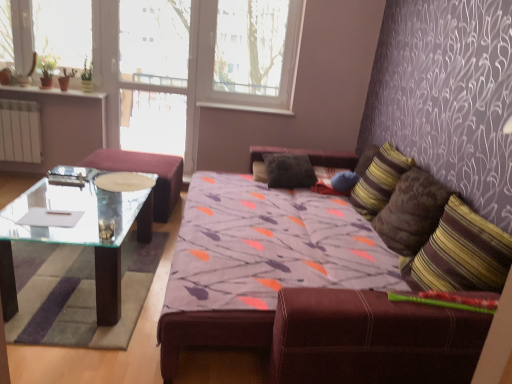
The width and height of the screenshot is (512, 384). I want to click on free space above transparent glass coffee table at left (from a real-world perspective), so click(x=57, y=255).